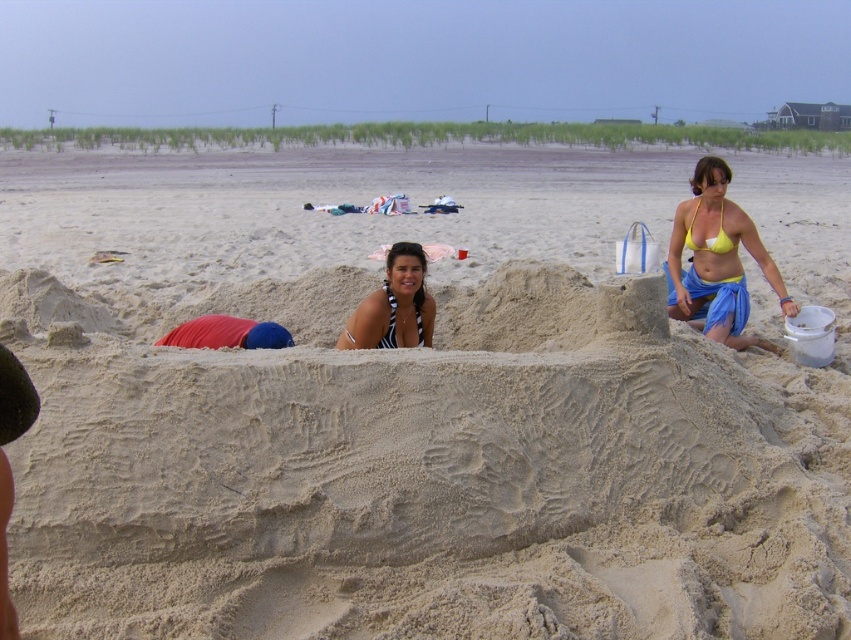
What is the exact coordinate of the black striped bikini top at center?

The black striped bikini top at center is located at point [393,305].